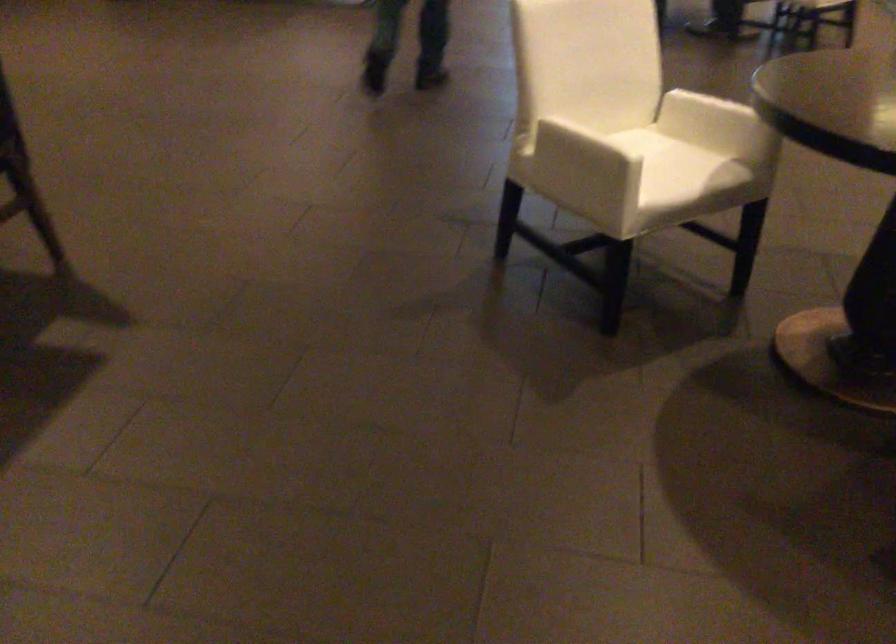
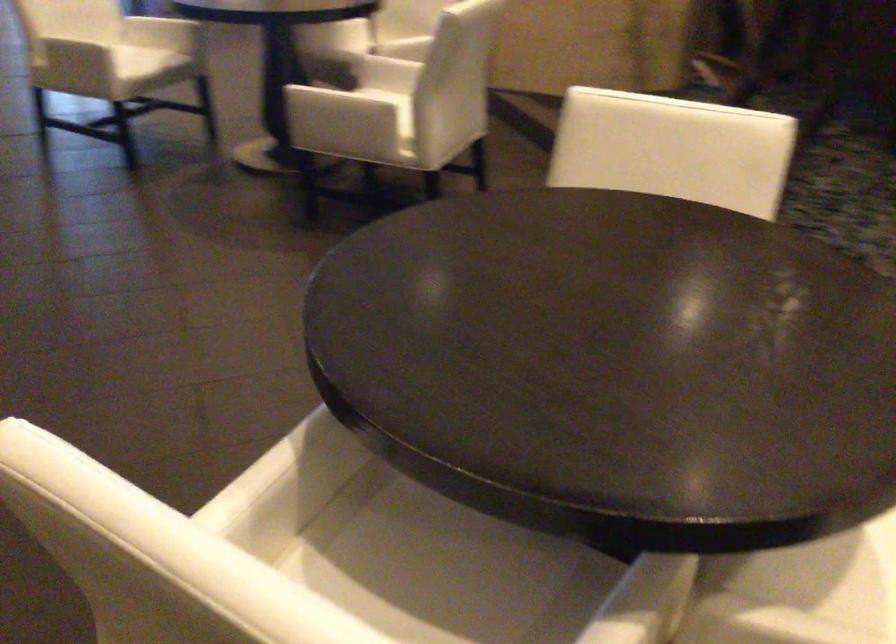
Locate, in the second image, the point that corresponds to pixel 624 194 in the first image.

(71, 39)